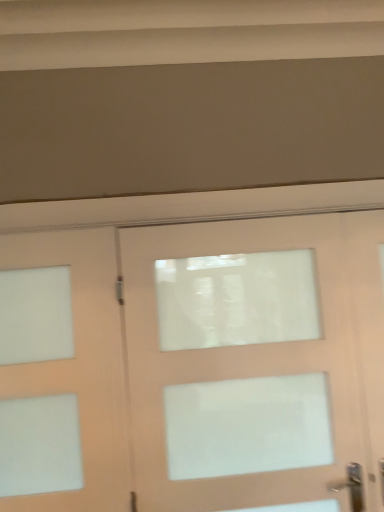
At what (x,y) coordinates should I click in order to perform the action: click on matte white door at left, acting as the first door starting from the left. Please return your answer as a coordinate pair (x, y). Looking at the image, I should click on (79, 366).

This screenshot has height=512, width=384. What do you see at coordinates (79, 366) in the screenshot? I see `matte white door at left, acting as the first door starting from the left` at bounding box center [79, 366].

Locate an element on the screen. This screenshot has height=512, width=384. white matte door at center, acting as the first door starting from the right is located at coordinates (256, 361).

This screenshot has height=512, width=384. Describe the element at coordinates (256, 361) in the screenshot. I see `white matte door at center, arranged as the second door when viewed from the left` at that location.

The width and height of the screenshot is (384, 512). Find the location of `matte white door at left, arranged as the 2th door when viewed from the right`. matte white door at left, arranged as the 2th door when viewed from the right is located at coordinates (79, 366).

Which is more to the right, matte white door at left, arranged as the 2th door when viewed from the right, or white matte door at center, acting as the first door starting from the right?

white matte door at center, acting as the first door starting from the right.

Considering the positions of objects matte white door at left, acting as the first door starting from the left, and white matte door at center, arranged as the second door when viewed from the left, in the image provided, who is behind, matte white door at left, acting as the first door starting from the left, or white matte door at center, arranged as the second door when viewed from the left,?

matte white door at left, acting as the first door starting from the left, is behind.

Which is closer, (x=102, y=242) or (x=138, y=230)?

The point (x=102, y=242) is in front.

From the image's perspective, is matte white door at left, arranged as the 2th door when viewed from the right, located beneath white matte door at center, acting as the first door starting from the right?

Actually, matte white door at left, arranged as the 2th door when viewed from the right, appears above white matte door at center, acting as the first door starting from the right, in the image.

From a real-world perspective, between matte white door at left, acting as the first door starting from the left, and white matte door at center, arranged as the second door when viewed from the left, who is vertically higher?

matte white door at left, acting as the first door starting from the left, from a real-world perspective.

Does matte white door at left, acting as the first door starting from the left, have a lesser width compared to white matte door at center, acting as the first door starting from the right?

Indeed, matte white door at left, acting as the first door starting from the left, has a lesser width compared to white matte door at center, acting as the first door starting from the right.

Who is taller, matte white door at left, arranged as the 2th door when viewed from the right, or white matte door at center, acting as the first door starting from the right?

white matte door at center, acting as the first door starting from the right.

Is matte white door at left, acting as the first door starting from the left, smaller than white matte door at center, acting as the first door starting from the right?

Yes, matte white door at left, acting as the first door starting from the left, is smaller than white matte door at center, acting as the first door starting from the right.

Choose the correct answer: Is matte white door at left, arranged as the 2th door when viewed from the right, inside white matte door at center, arranged as the second door when viewed from the left, or outside it?

matte white door at left, arranged as the 2th door when viewed from the right, exists outside the volume of white matte door at center, arranged as the second door when viewed from the left.

Is matte white door at left, arranged as the 2th door when viewed from the right, not near white matte door at center, arranged as the second door when viewed from the left?

No, matte white door at left, arranged as the 2th door when viewed from the right, is in close proximity to white matte door at center, arranged as the second door when viewed from the left.

Is matte white door at left, arranged as the 2th door when viewed from the right, facing towards white matte door at center, acting as the first door starting from the right?

No, matte white door at left, arranged as the 2th door when viewed from the right, is not facing towards white matte door at center, acting as the first door starting from the right.

How different are the orientations of matte white door at left, arranged as the 2th door when viewed from the right, and white matte door at center, arranged as the second door when viewed from the left, in degrees?

The angular difference between matte white door at left, arranged as the 2th door when viewed from the right, and white matte door at center, arranged as the second door when viewed from the left, is 0.00544 degrees.

Measure the distance from matte white door at left, acting as the first door starting from the left, to white matte door at center, arranged as the second door when viewed from the left.

matte white door at left, acting as the first door starting from the left, and white matte door at center, arranged as the second door when viewed from the left, are 40.04 centimeters apart from each other.

Where is `door behind the white matte door at center, arranged as the second door when viewed from the left`? door behind the white matte door at center, arranged as the second door when viewed from the left is located at coordinates (79, 366).

Which is more to the right, white matte door at center, acting as the first door starting from the right, or matte white door at left, arranged as the 2th door when viewed from the right?

white matte door at center, acting as the first door starting from the right.

Between white matte door at center, arranged as the second door when viewed from the left, and matte white door at left, arranged as the 2th door when viewed from the right, which one is positioned in front?

white matte door at center, arranged as the second door when viewed from the left, is closer to the camera.

Is point (209, 243) closer or farther from the camera than point (67, 256)?

Point (209, 243) appears to be farther away from the viewer than point (67, 256).

From the image's perspective, which one is positioned lower, white matte door at center, arranged as the second door when viewed from the left, or matte white door at left, arranged as the 2th door when viewed from the right?

white matte door at center, arranged as the second door when viewed from the left.

From a real-world perspective, is white matte door at center, acting as the first door starting from the right, above or below matte white door at left, acting as the first door starting from the left?

From a real-world perspective, white matte door at center, acting as the first door starting from the right, is physically below matte white door at left, acting as the first door starting from the left.

Between white matte door at center, acting as the first door starting from the right, and matte white door at left, arranged as the 2th door when viewed from the right, which one has smaller width?

matte white door at left, arranged as the 2th door when viewed from the right.

From their relative heights in the image, would you say white matte door at center, acting as the first door starting from the right, is taller or shorter than matte white door at left, arranged as the 2th door when viewed from the right?

Clearly, white matte door at center, acting as the first door starting from the right, is taller compared to matte white door at left, arranged as the 2th door when viewed from the right.

Looking at this image, is white matte door at center, acting as the first door starting from the right, bigger than matte white door at left, acting as the first door starting from the left?

Yes, white matte door at center, acting as the first door starting from the right, is bigger than matte white door at left, acting as the first door starting from the left.

Is matte white door at left, acting as the first door starting from the left, completely or partially inside white matte door at center, arranged as the second door when viewed from the left?

No, matte white door at left, acting as the first door starting from the left, is located outside of white matte door at center, arranged as the second door when viewed from the left.

Is white matte door at center, acting as the first door starting from the right, far from matte white door at left, acting as the first door starting from the left?

Actually, white matte door at center, acting as the first door starting from the right, and matte white door at left, acting as the first door starting from the left, are a little close together.

Is white matte door at center, acting as the first door starting from the right, aimed at matte white door at left, acting as the first door starting from the left?

No, white matte door at center, acting as the first door starting from the right, is not turned towards matte white door at left, acting as the first door starting from the left.

In the scene shown: How many degrees apart are the facing directions of white matte door at center, arranged as the second door when viewed from the left, and matte white door at left, acting as the first door starting from the left?

white matte door at center, arranged as the second door when viewed from the left, and matte white door at left, acting as the first door starting from the left, are facing 0.00544 degrees away from each other.

Measure the distance from white matte door at center, acting as the first door starting from the right, to matte white door at left, arranged as the 2th door when viewed from the right.

white matte door at center, acting as the first door starting from the right, is 15.76 inches from matte white door at left, arranged as the 2th door when viewed from the right.

Image resolution: width=384 pixels, height=512 pixels. Identify the location of door below the matte white door at left, arranged as the 2th door when viewed from the right (from the image's perspective). (256, 361).

The width and height of the screenshot is (384, 512). What are the coordinates of `door above the white matte door at center, acting as the first door starting from the right (from the image's perspective)` in the screenshot? It's located at (79, 366).

Where is `door located below the matte white door at left, acting as the first door starting from the left (from the image's perspective)`? The height and width of the screenshot is (512, 384). door located below the matte white door at left, acting as the first door starting from the left (from the image's perspective) is located at coordinates (256, 361).